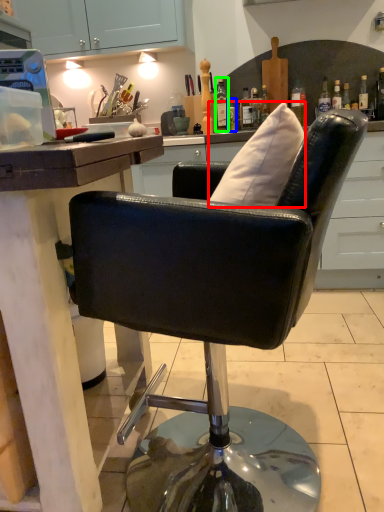
Question: Estimate the real-world distances between objects in this image. Which object is closer to pillow (highlighted by a red box), bottle (highlighted by a blue box) or bottle (highlighted by a green box)?

Choices:
 (A) bottle
 (B) bottle

Answer: (A)